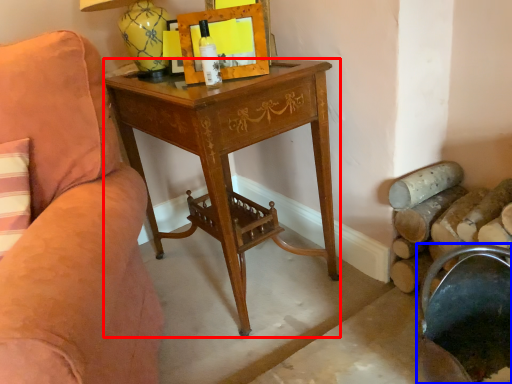
Question: Which of the following is the closest to the observer, desk (highlighted by a red box) or rocking chair (highlighted by a blue box)?

Choices:
 (A) desk
 (B) rocking chair

Answer: (B)